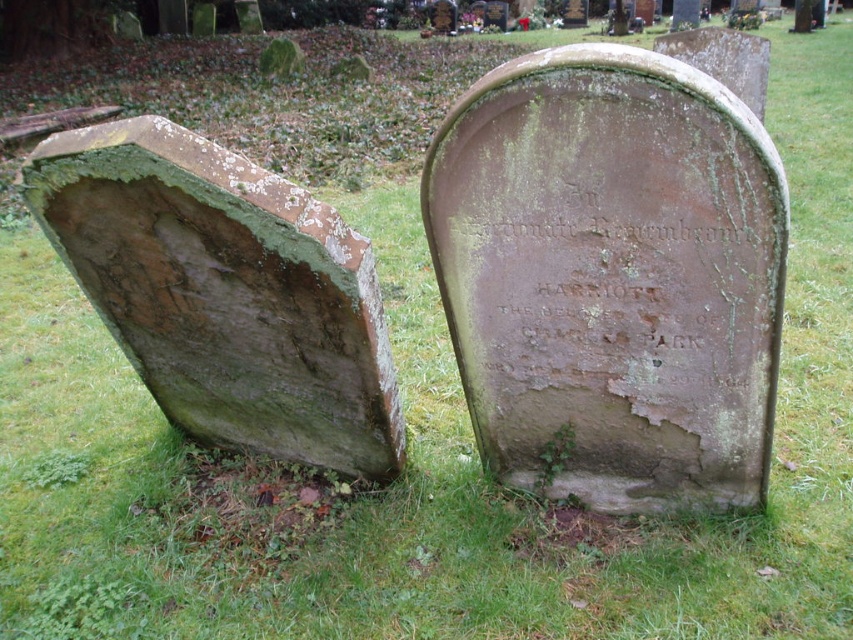
You are standing at the point marked by the coordinate point at (612, 276) in the cemetery scene. What is the object directly beneath your feet?

The point at (612, 276) is located on the green mossy stone at center, so the object directly beneath your feet is the green mossy stone at center.

You are standing at the center of the cemetery and want to place a flower on the green mossy stone at center. Based on the coordinates provided, in which direction should you move to reach it?

The green mossy stone at center is located at coordinates point (612, 276), so you should move towards the direction of the point to reach it.